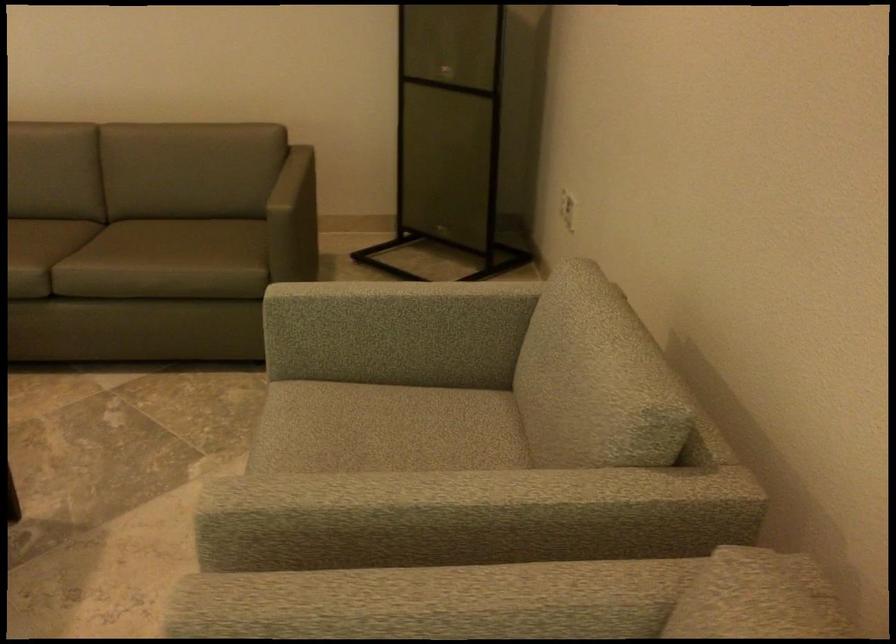
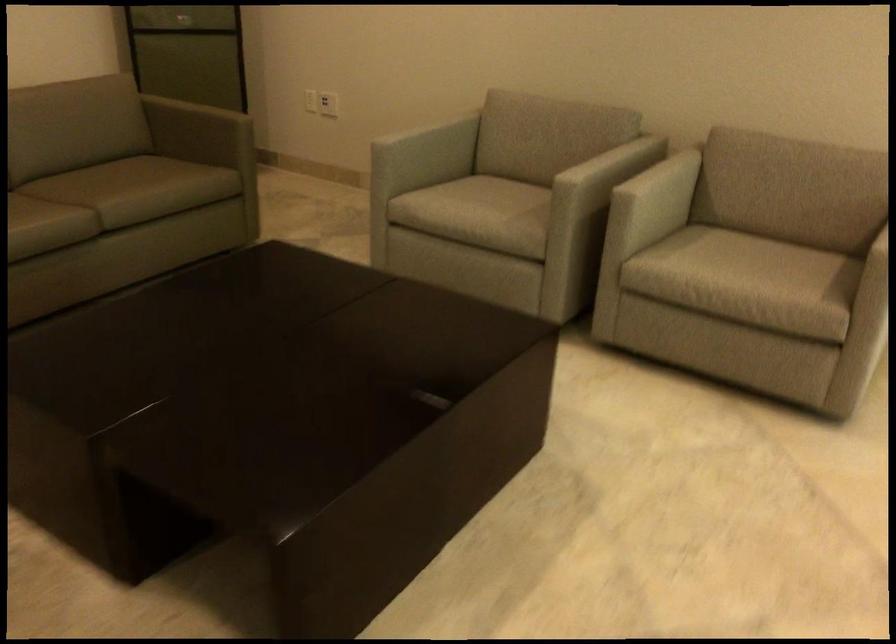
The point at (119, 270) is marked in the first image. Where is the corresponding point in the second image?

(145, 187)